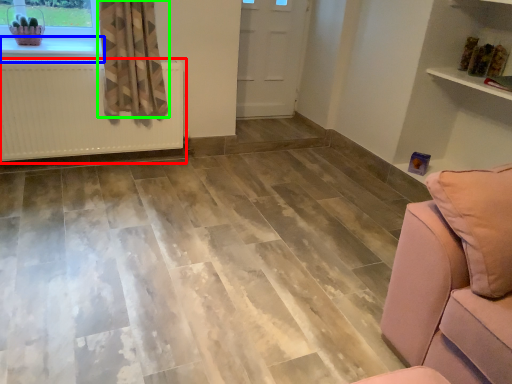
Question: Which is nearer to the radiator (highlighted by a red box)? window sill (highlighted by a blue box) or curtain (highlighted by a green box).

Choices:
 (A) window sill
 (B) curtain

Answer: (B)